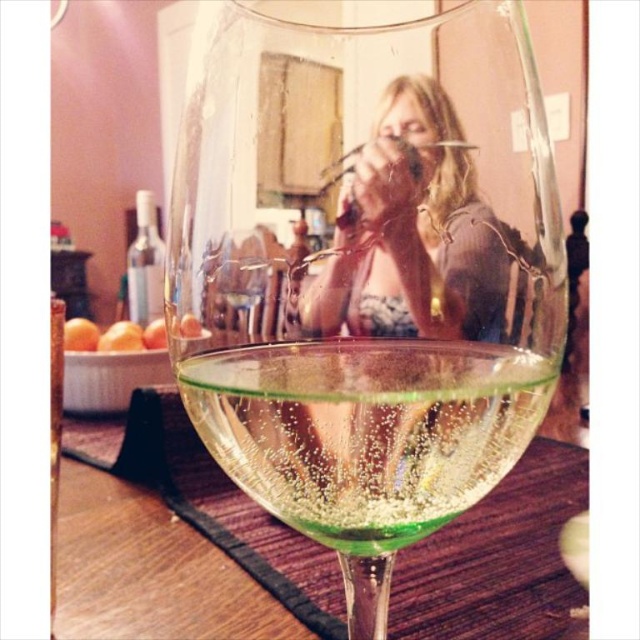
Which is more to the right, green translucent wine glass at center or green glass wine at center?

From the viewer's perspective, green translucent wine glass at center appears more on the right side.

Is point (470, 388) farther from camera compared to point (394, 378)?

Yes, it is.

At what (x,y) coordinates should I click in order to perform the action: click on green translucent wine glass at center. Please return your answer as a coordinate pair (x, y). Looking at the image, I should click on (365, 276).

Is green translucent wine glass at center positioned at the back of translucent glass at center?

No, green translucent wine glass at center is in front of translucent glass at center.

Is green translucent wine glass at center closer to the viewer compared to translucent glass at center?

Yes, green translucent wine glass at center is closer to the viewer.

Which is behind, point (346, 326) or point (336, 314)?

Point (336, 314)

Locate an element on the screen. green translucent wine glass at center is located at coordinates (365, 276).

Is green glass wine at center to the right of translucent glass at center from the viewer's perspective?

No, green glass wine at center is not to the right of translucent glass at center.

Is green glass wine at center above translucent glass at center?

Incorrect, green glass wine at center is not positioned above translucent glass at center.

Where is `green glass wine at center`? The height and width of the screenshot is (640, 640). green glass wine at center is located at coordinates (365, 429).

I want to click on green glass wine at center, so click(365, 429).